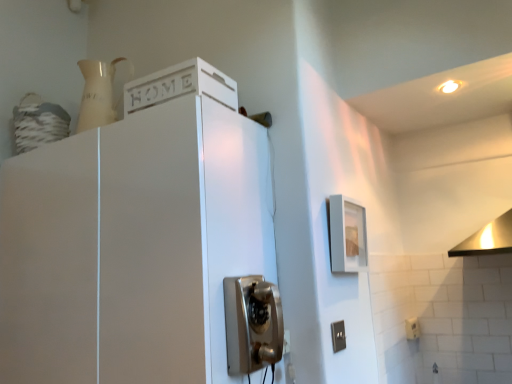
Question: From the image's perspective, is white plastic electric outlet at lower right, the second electric outlet when ordered from top to bottom, above or below metallic vintage phone at center?

Choices:
 (A) above
 (B) below

Answer: (B)

Question: Considering their positions, is white plastic electric outlet at lower right, marked as the 1th electric outlet in a right-to-left arrangement, located in front of or behind metallic vintage phone at center?

Choices:
 (A) front
 (B) behind

Answer: (B)

Question: Which object is positioned farthest from the white matte cabinet at upper left?

Choices:
 (A) metallic vintage phone at center
 (B) gray plastic electrical outlet at lower right, acting as the first electric outlet starting from the front
 (C) white plastic electric outlet at lower right, which is counted as the 2th electric outlet, starting from the front

Answer: (C)

Question: Which of these objects is positioned closest to the metallic vintage phone at center?

Choices:
 (A) white plastic electric outlet at lower right, the 2th electric outlet positioned from the left
 (B) white matte cabinet at upper left
 (C) gray plastic electrical outlet at lower right, which ranks as the first electric outlet in left-to-right order

Answer: (B)